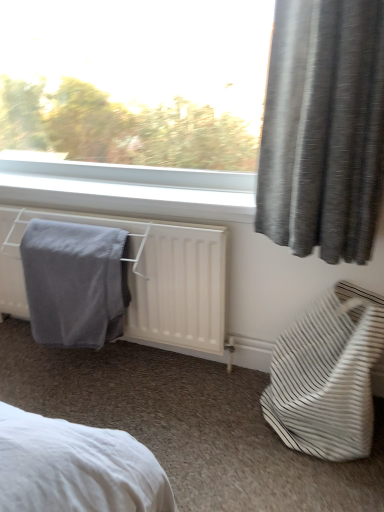
Where is `free spot in front of white striped fabric bag at lower right`? free spot in front of white striped fabric bag at lower right is located at coordinates (311, 483).